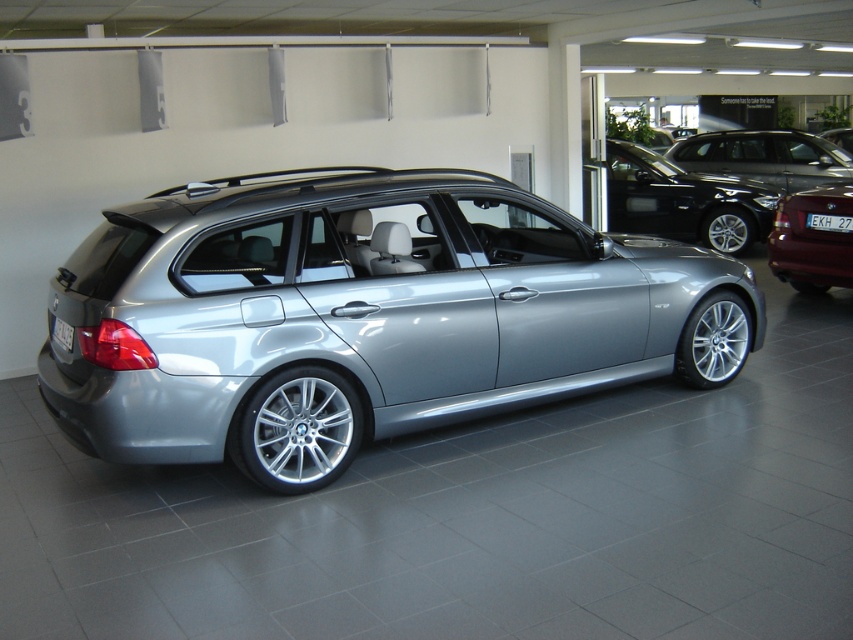
Can you confirm if satin black car at upper center is positioned below black plastic license plate at rear?

No, satin black car at upper center is not below black plastic license plate at rear.

Can you confirm if satin black car at upper center is positioned to the right of black plastic license plate at rear?

Correct, you'll find satin black car at upper center to the right of black plastic license plate at rear.

Which is behind, point (825, 156) or point (68, 344)?

The point (825, 156) is more distant.

This screenshot has width=853, height=640. I want to click on satin black car at upper center, so click(764, 156).

Can you confirm if satin black sedan at upper center is positioned to the left of black plastic license plate at center?

Yes, satin black sedan at upper center is to the left of black plastic license plate at center.

Which is above, satin black sedan at upper center or black plastic license plate at center?

Positioned higher is satin black sedan at upper center.

Locate an element on the screen. satin black sedan at upper center is located at coordinates (683, 200).

Is metallic red car at right smaller than black plastic license plate at center?

Incorrect, metallic red car at right is not smaller in size than black plastic license plate at center.

Who is more forward, (811, 234) or (834, 221)?

Point (834, 221)

This screenshot has width=853, height=640. Describe the element at coordinates (813, 237) in the screenshot. I see `metallic red car at right` at that location.

Where is `metallic red car at right`? Image resolution: width=853 pixels, height=640 pixels. metallic red car at right is located at coordinates (813, 237).